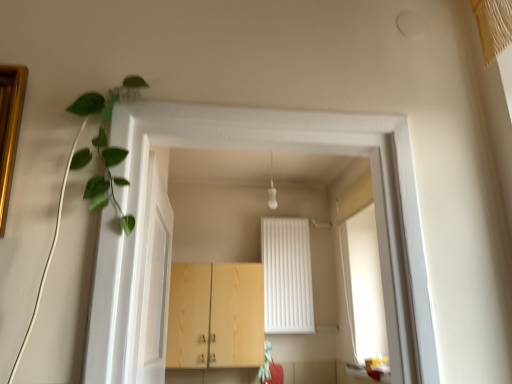
Question: Should I look upward or downward to see light wood cabinet at center?

Choices:
 (A) down
 (B) up

Answer: (A)

Question: Is white glossy door at left outside green leafy plant at upper left?

Choices:
 (A) no
 (B) yes

Answer: (B)

Question: Is white glossy door at left aimed at green leafy plant at upper left?

Choices:
 (A) no
 (B) yes

Answer: (A)

Question: Would you consider white glossy door at left to be distant from green leafy plant at upper left?

Choices:
 (A) yes
 (B) no

Answer: (B)

Question: Is green leafy plant at upper left at the back of white glossy door at left?

Choices:
 (A) yes
 (B) no

Answer: (B)

Question: Can you confirm if white glossy door at left is shorter than green leafy plant at upper left?

Choices:
 (A) no
 (B) yes

Answer: (A)

Question: Can you confirm if white glossy door at left is positioned to the left of green leafy plant at upper left?

Choices:
 (A) no
 (B) yes

Answer: (A)

Question: Does light wood cabinet at center have a greater width compared to green leafy plant at upper left?

Choices:
 (A) yes
 (B) no

Answer: (A)

Question: Considering the relative sizes of light wood cabinet at center and green leafy plant at upper left in the image provided, is light wood cabinet at center shorter than green leafy plant at upper left?

Choices:
 (A) yes
 (B) no

Answer: (B)

Question: From a real-world perspective, is light wood cabinet at center located higher than green leafy plant at upper left?

Choices:
 (A) no
 (B) yes

Answer: (A)

Question: From the image's perspective, would you say light wood cabinet at center is shown under green leafy plant at upper left?

Choices:
 (A) no
 (B) yes

Answer: (B)

Question: Is light wood cabinet at center at the left side of green leafy plant at upper left?

Choices:
 (A) yes
 (B) no

Answer: (B)

Question: Is light wood cabinet at center to the right of green leafy plant at upper left from the viewer's perspective?

Choices:
 (A) no
 (B) yes

Answer: (B)

Question: Is green leafy plant at upper left aimed at light wood cabinet at center?

Choices:
 (A) no
 (B) yes

Answer: (A)